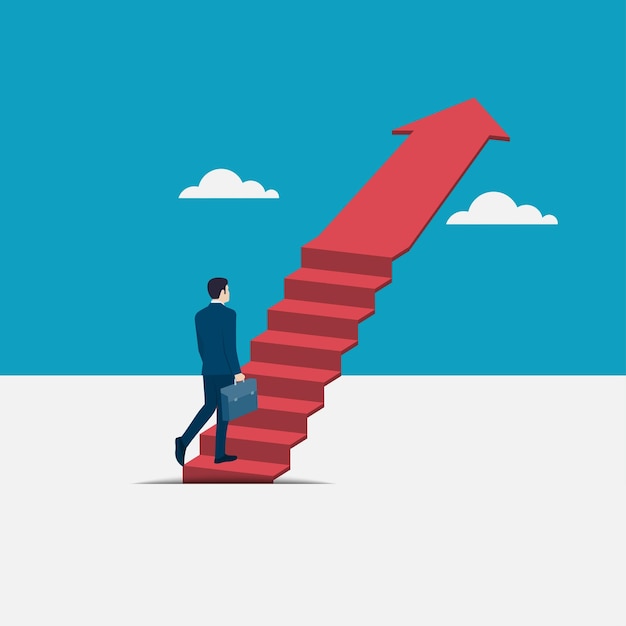
The image size is (626, 626). What are the coordinates of `stair` in the screenshot? It's located at (243, 474), (263, 439), (285, 407), (303, 374), (316, 341), (332, 308), (346, 275), (355, 247).